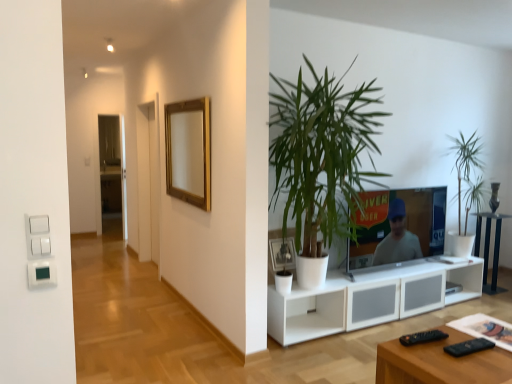
Question: Considering the relative sizes of green leafy plant at right, which appears as the 1th houseplant when viewed from the back, and black glass side table at lower right in the image provided, is green leafy plant at right, which appears as the 1th houseplant when viewed from the back, bigger than black glass side table at lower right?

Choices:
 (A) yes
 (B) no

Answer: (A)

Question: Is green leafy plant at right, placed as the first houseplant when sorted from right to left, to the left of black glass side table at lower right from the viewer's perspective?

Choices:
 (A) yes
 (B) no

Answer: (A)

Question: From the image's perspective, is green leafy plant at right, which appears as the 1th houseplant when viewed from the back, located beneath black glass side table at lower right?

Choices:
 (A) no
 (B) yes

Answer: (A)

Question: Can you confirm if green leafy plant at right, the 2th houseplant positioned from the front, is shorter than black glass side table at lower right?

Choices:
 (A) no
 (B) yes

Answer: (A)

Question: Is green leafy plant at right, the 2th houseplant positioned from the front, facing away from black glass side table at lower right?

Choices:
 (A) yes
 (B) no

Answer: (B)

Question: Is point (497, 183) closer or farther from the camera than point (284, 256)?

Choices:
 (A) farther
 (B) closer

Answer: (A)

Question: From the image's perspective, is white ceramic vase at center above or below white matte picture frame at center, marked as the first picture frame in a front-to-back arrangement?

Choices:
 (A) above
 (B) below

Answer: (A)

Question: Looking at the image, does white ceramic vase at center seem bigger or smaller compared to white matte picture frame at center, which is the 1th picture frame in bottom-to-top order?

Choices:
 (A) big
 (B) small

Answer: (B)

Question: In terms of width, does white ceramic vase at center look wider or thinner when compared to white matte picture frame at center, acting as the 1th picture frame starting from the right?

Choices:
 (A) wide
 (B) thin

Answer: (B)

Question: Looking at their shapes, would you say transparent glass door at center is wider or thinner than black plastic remote at lower right, which is the 2th remote in left-to-right order?

Choices:
 (A) thin
 (B) wide

Answer: (A)

Question: From the image's perspective, relative to black plastic remote at lower right, which is the 2th remote in left-to-right order, is transparent glass door at center above or below?

Choices:
 (A) below
 (B) above

Answer: (B)

Question: Choose the correct answer: Is transparent glass door at center inside black plastic remote at lower right, which is the 2th remote in left-to-right order, or outside it?

Choices:
 (A) outside
 (B) inside

Answer: (A)

Question: Considering the positions of transparent glass door at center and black plastic remote at lower right, which is the first remote in right-to-left order, in the image, is transparent glass door at center taller or shorter than black plastic remote at lower right, which is the first remote in right-to-left order,?

Choices:
 (A) short
 (B) tall

Answer: (B)

Question: Considering the positions of transparent glass door at center and gold wooden picture frame at upper center, which is counted as the first picture frame, starting from the left, in the image, is transparent glass door at center wider or thinner than gold wooden picture frame at upper center, which is counted as the first picture frame, starting from the left,?

Choices:
 (A) wide
 (B) thin

Answer: (B)

Question: In the image, is transparent glass door at center on the left side or the right side of gold wooden picture frame at upper center, acting as the first picture frame starting from the top?

Choices:
 (A) right
 (B) left

Answer: (B)